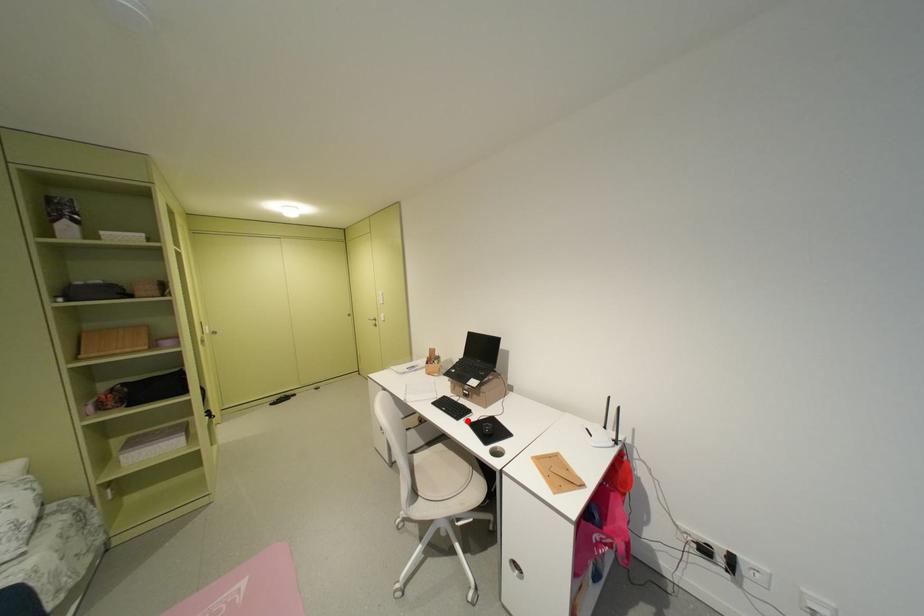
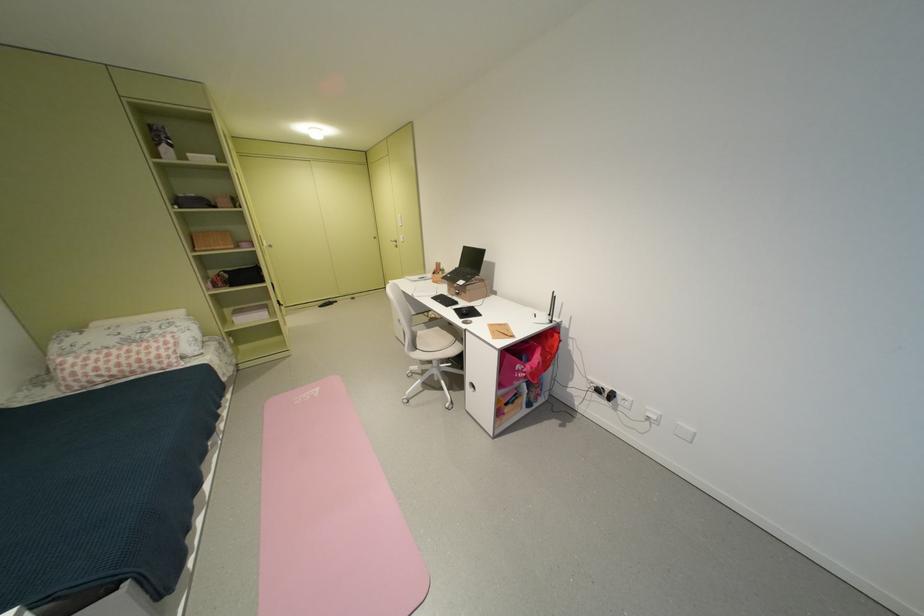
In the second image, find the point that corresponds to the highlighted location in the first image.

(456, 307)